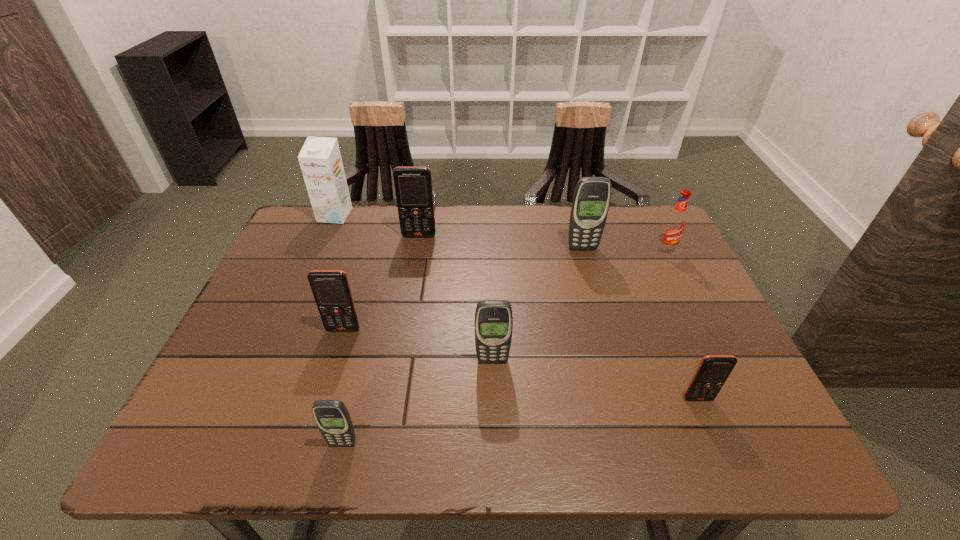
The height and width of the screenshot is (540, 960). I want to click on the second smallest orange cellular telephone, so click(331, 289).

Where is `the fifth farthest object`? the fifth farthest object is located at coordinates point(331,289).

Identify the location of the second nearest cellular telephone. The image size is (960, 540). (713, 370).

The height and width of the screenshot is (540, 960). In order to click on the seventh farthest object in this screenshot , I will do `click(713, 370)`.

Identify the location of the nearest object. (333, 420).

At what (x,y) coordinates should I click in order to perform the action: click on the smallest gray cellular telephone. Please return your answer as a coordinate pair (x, y). This screenshot has height=540, width=960. Looking at the image, I should click on (333, 420).

The image size is (960, 540). Find the location of `vacant point located on the front of the leftmost object`. vacant point located on the front of the leftmost object is located at coordinates (326, 234).

At what (x,y) coordinates should I click in order to perform the action: click on vacant space located on the screen of the farthest orange cellular telephone. Please return your answer as a coordinate pair (x, y). This screenshot has width=960, height=540. Looking at the image, I should click on (408, 299).

Find the location of `vacant area situated on the screen of the third object from right to left`. vacant area situated on the screen of the third object from right to left is located at coordinates (597, 301).

This screenshot has height=540, width=960. What are the coordinates of `vacant region located 0.200m on the front of the root beer` in the screenshot? It's located at (694, 307).